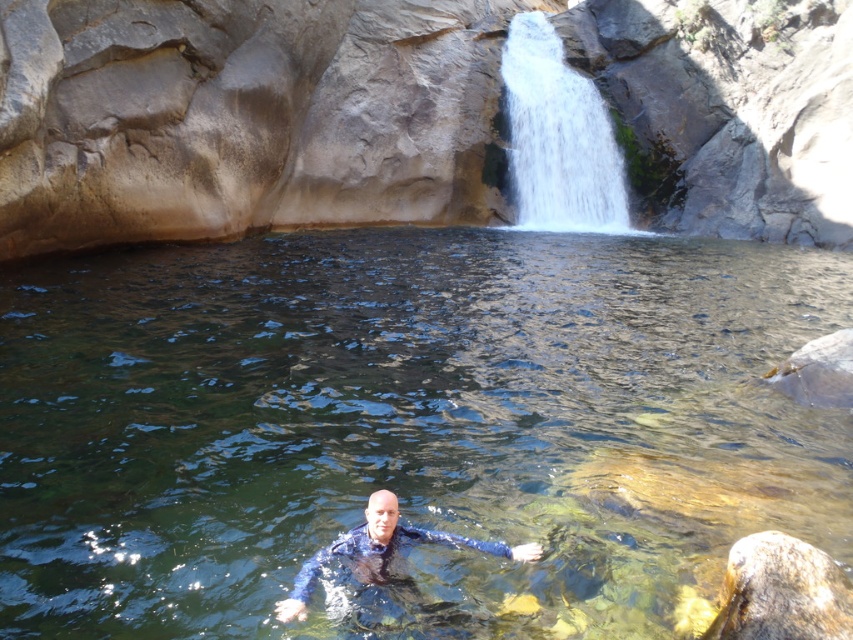
Question: Which object appears closest to the camera in this image?

Choices:
 (A) clear water at center
 (B) white frothy water at upper center
 (C) blue rubber wetsuit at center

Answer: (A)

Question: Does white frothy water at upper center lie behind blue rubber wetsuit at center?

Choices:
 (A) no
 (B) yes

Answer: (B)

Question: Does clear water at center have a greater width compared to blue rubber wetsuit at center?

Choices:
 (A) no
 (B) yes

Answer: (B)

Question: Does clear water at center appear over white frothy water at upper center?

Choices:
 (A) yes
 (B) no

Answer: (B)

Question: Which object is closer to the camera taking this photo?

Choices:
 (A) clear water at center
 (B) blue rubber wetsuit at center
 (C) white frothy water at upper center

Answer: (A)

Question: Based on their relative distances, which object is farther from the white frothy water at upper center?

Choices:
 (A) blue rubber wetsuit at center
 (B) clear water at center

Answer: (A)